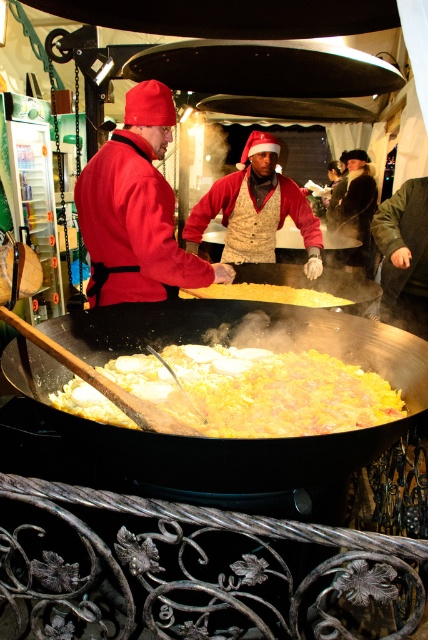
Which is behind, point (65, 417) or point (80, 214)?

Positioned behind is point (80, 214).

Image resolution: width=428 pixels, height=640 pixels. I want to click on black matte wok at center, so click(x=219, y=438).

Is point (288, 320) closer to camera compared to point (146, 284)?

Yes, it is.

Where is `black matte wok at center`? black matte wok at center is located at coordinates (219, 438).

Is point (223, 449) more distant than point (234, 298)?

No, it is not.

Consider the image. Can you confirm if black matte wok at center is positioned to the right of yellow matte food at center?

In fact, black matte wok at center is to the left of yellow matte food at center.

Image resolution: width=428 pixels, height=640 pixels. Find the location of `black matte wok at center`. black matte wok at center is located at coordinates (219, 438).

Is point (133, 380) positioned behind point (270, 291)?

No, (133, 380) is in front of (270, 291).

From the picture: Between yellow rice at center and yellow matte food at center, which one has less height?

yellow matte food at center is shorter.

Is point (202, 410) positioned behind point (238, 291)?

No, it is not.

Identify the location of yellow rice at center. This screenshot has width=428, height=640. (258, 390).